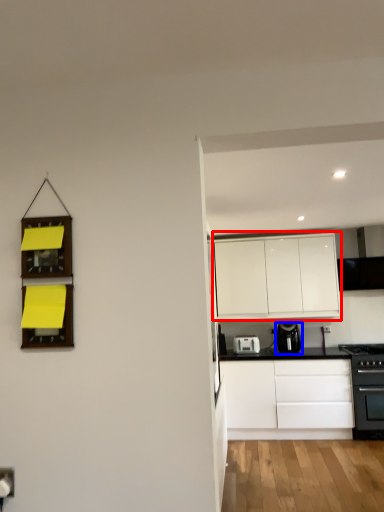
Question: Which point is closer to the camera, cabinetry (highlighted by a red box) or kitchen appliance (highlighted by a blue box)?

Choices:
 (A) cabinetry
 (B) kitchen appliance

Answer: (B)